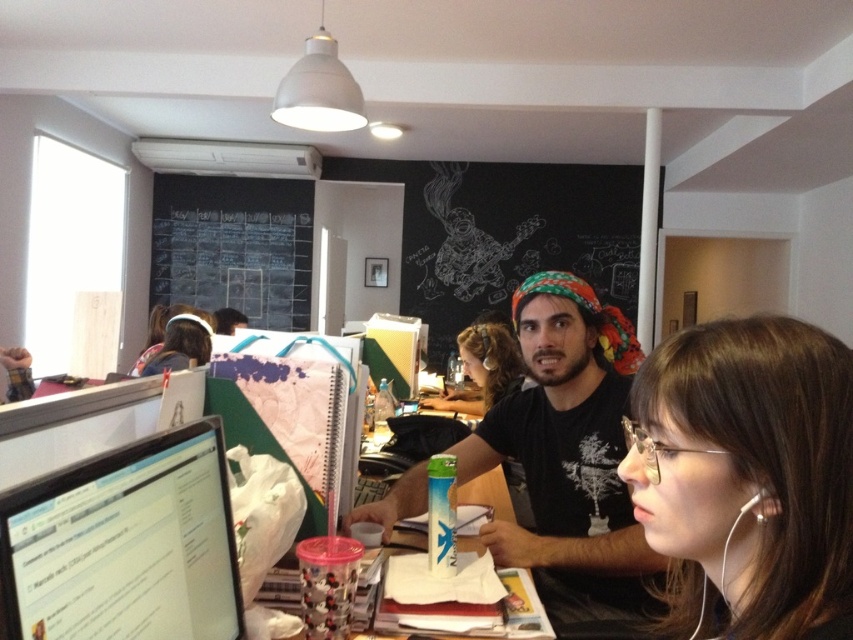
You are organizing the desk items and need to place a new item between the matte black monitor at left and the white earphone at lower right. Based on their positions, where should you place the new item?

The new item should be placed between the matte black monitor at left and the white earphone at lower right, as the monitor is positioned to the left of the earphone.

Looking at this image, you are organizing cables in the workspace and need to route a cable from the matte black monitor at left to the white earphone at lower right. Based on their positions, which direction should the cable go relative to the monitor?

The matte black monitor at left is in front of the white earphone at lower right, so the cable should go behind the monitor to reach the earphone.